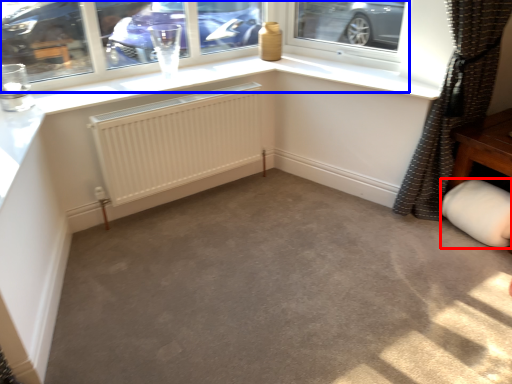
Question: Which point is closer to the camera, gray (highlighted by a red box) or window (highlighted by a blue box)?

Choices:
 (A) gray
 (B) window

Answer: (B)